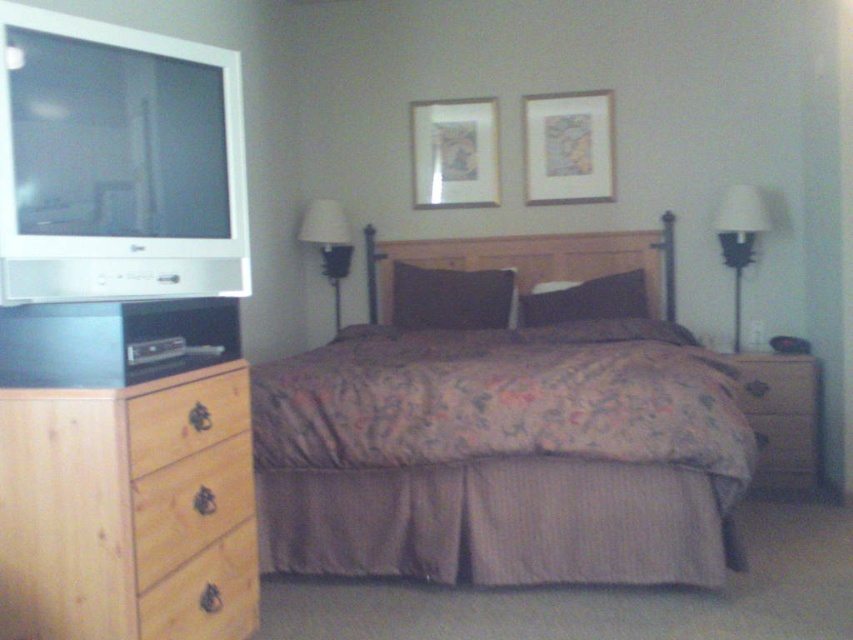
Looking at this image, you are trying to decide whether to place a small decorative item on the brown wood drawer at lower left or on the white fabric lampshade at center. Which surface can accommodate the item better based on their heights?

The white fabric lampshade at center is taller than the brown wood drawer at lower left, so placing the item on the brown wood drawer at lower left would be more stable and suitable for the decorative item.

You are standing in the bedroom and want to place a small vase between the brown wood drawer at lower left and the white fabric lampshade at center. Which object should you place the vase closer to if you want it to be nearer to the viewer?

You should place the vase closer to the brown wood drawer at lower left because it is closer to the viewer than the white fabric lampshade at center.

You are standing at the entrance of the bedroom and want to place a new plant on the light wood dresser at left. To do this, you need to walk towards the dresser. In which direction should you move relative to your starting position at the entrance?

The light wood dresser at left is located at point 0.739 on the x axis and 0.148 on the y axis. Since the entrance is not specified in the scene description, the exact direction cannot be determined.